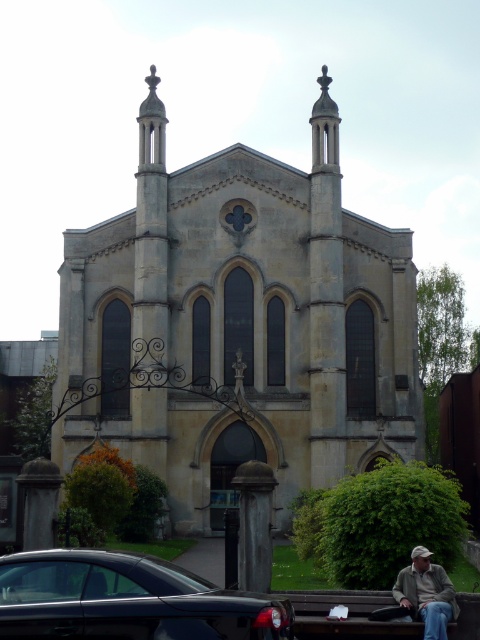
What do you see at coordinates (239, 324) in the screenshot? Image resolution: width=480 pixels, height=640 pixels. I see `light beige stone church at center` at bounding box center [239, 324].

The height and width of the screenshot is (640, 480). Find the location of `light beige stone church at center`. light beige stone church at center is located at coordinates (239, 324).

The height and width of the screenshot is (640, 480). Identify the location of light beige stone church at center. (239, 324).

Which is below, wooden bench at lower center or khaki fabric jacket at lower right?

wooden bench at lower center is below.

Is point (459, 637) more distant than point (428, 608)?

Yes, it is.

Who is more forward, (x=364, y=625) or (x=415, y=595)?

Point (x=364, y=625)

Locate an element on the screen. The width and height of the screenshot is (480, 640). wooden bench at lower center is located at coordinates (348, 614).

Can you confirm if light beige stone church at center is wider than shiny black car at lower left?

Yes.

Does light beige stone church at center come in front of shiny black car at lower left?

No, it is not.

You are a GUI agent. You are given a task and a screenshot of the screen. Output one action in this format:
    pyautogui.click(x=<x>, y=<y>)
    Task: Click on the light beige stone church at center
    This screenshot has width=480, height=640.
    Given the screenshot: What is the action you would take?
    pyautogui.click(x=239, y=324)